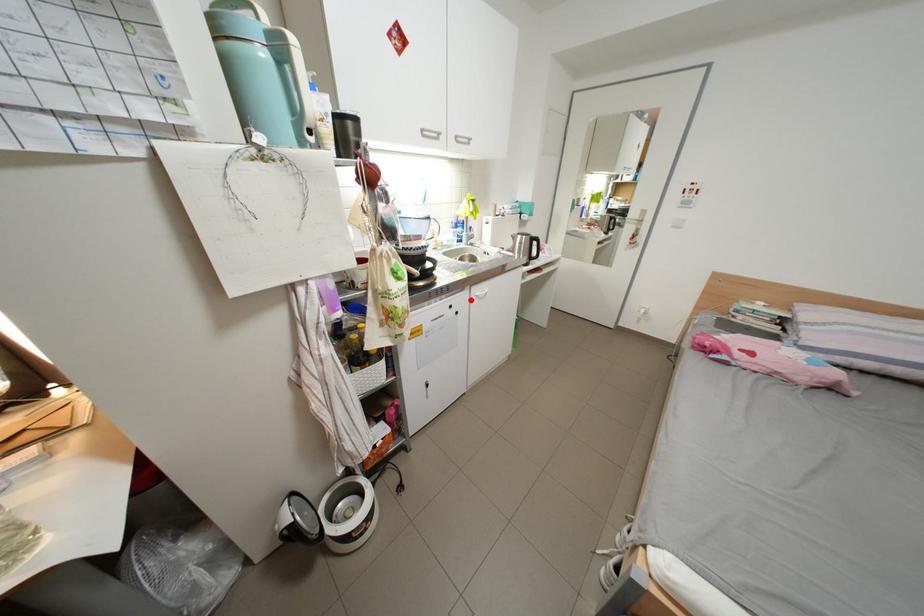
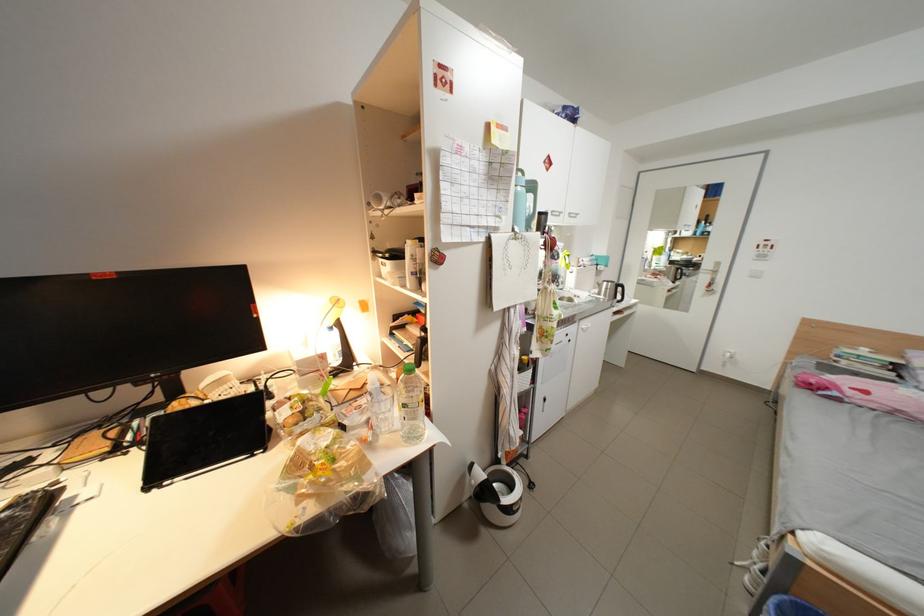
Question: I am providing you with two images of the same scene from different viewpoints. A red point is shown in image1. For the corresponding object point in image2, is it positioned nearer or farther from the camera?

Choices:
 (A) Nearer
 (B) Farther

Answer: (B)